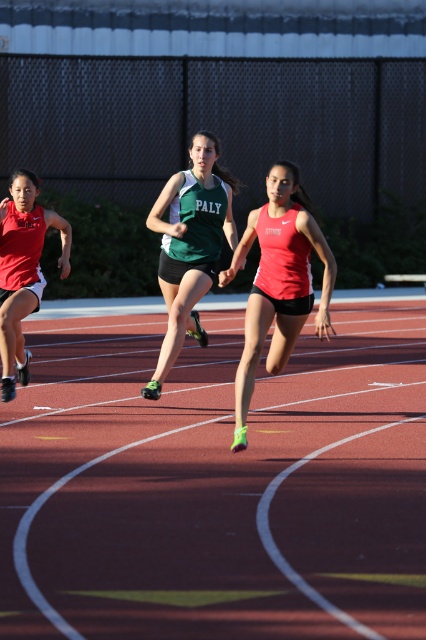
You are a photographer standing at the finish line of the track and field event. You need to capture a photo where the red rubber track at center is visible behind the matte red tank top at left. Is this possible based on their positions?

Yes, the red rubber track at center is positioned below the matte red tank top at left, so the track will be visible behind the athlete wearing the matte red tank top at left in the photo.

You are a photographer at the track and field event. You need to place a camera at the point marked by coordinates point [213,481]. According to the scene description, what object will the camera be positioned on?

The camera will be positioned on the red rubber track at center as the coordinates point [213,481] marks this location.

You are a spectator at the track and field event and want to know how far the point at coordinates (290, 205) is from your current position. Can you determine the distance?

The point at coordinates (290, 205) is 9.50 meters away from the viewer.